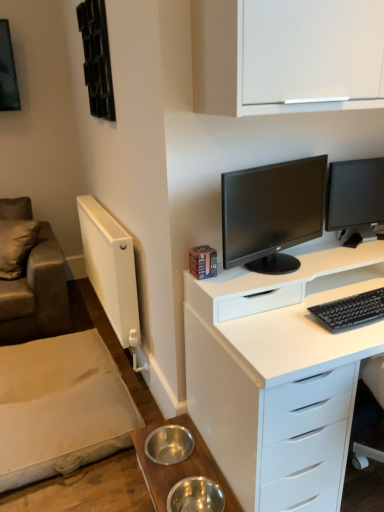
Describe the element at coordinates (286, 55) in the screenshot. I see `white matte cabinet at upper center` at that location.

This screenshot has height=512, width=384. What do you see at coordinates (355, 198) in the screenshot? I see `black glossy monitor at right, arranged as the first computer monitor when viewed from the right` at bounding box center [355, 198].

How much space does black glossy monitor at right, the second computer monitor when ordered from left to right, occupy vertically?

black glossy monitor at right, the second computer monitor when ordered from left to right, is 38.30 centimeters in height.

What do you see at coordinates (60, 407) in the screenshot? I see `beige fabric at lower left` at bounding box center [60, 407].

What do you see at coordinates (36, 294) in the screenshot?
I see `leather-like brown couch at left` at bounding box center [36, 294].

Identify the location of white matte cabinet at upper center. (286, 55).

From the image's perspective, is metallic stainless steel bowls at lower center above or below beige fabric at lower left?

From the image's perspective, metallic stainless steel bowls at lower center appears below beige fabric at lower left.

What's the angular difference between metallic stainless steel bowls at lower center and beige fabric at lower left's facing directions?

0.479 degrees separate the facing orientations of metallic stainless steel bowls at lower center and beige fabric at lower left.

Based on their positions, is metallic stainless steel bowls at lower center located to the left or right of beige fabric at lower left?

Based on their positions, metallic stainless steel bowls at lower center is located to the right of beige fabric at lower left.

Could you tell me if black matte keyboard at right is facing metallic stainless steel bowls at lower center?

No.

From a real-world perspective, relative to metallic stainless steel bowls at lower center, is black matte keyboard at right vertically above or below?

black matte keyboard at right is situated higher than metallic stainless steel bowls at lower center in the real world.

How different are the orientations of black matte keyboard at right and metallic stainless steel bowls at lower center in degrees?

They differ by 90.5 degrees in their facing directions.

Considering the relative sizes of black matte keyboard at right and metallic stainless steel bowls at lower center in the image provided, is black matte keyboard at right thinner than metallic stainless steel bowls at lower center?

Indeed, black matte keyboard at right has a lesser width compared to metallic stainless steel bowls at lower center.

Is point (207, 113) closer to camera compared to point (155, 509)?

Yes, it is in front of point (155, 509).

Is white matte cabinet at upper center outside of metallic stainless steel bowls at lower center?

Indeed, white matte cabinet at upper center is completely outside metallic stainless steel bowls at lower center.

Based on their sizes in the image, would you say white matte cabinet at upper center is bigger or smaller than metallic stainless steel bowls at lower center?

Clearly, white matte cabinet at upper center is larger in size than metallic stainless steel bowls at lower center.

From a real-world perspective, is white matte cabinet at upper center above or below metallic stainless steel bowls at lower center?

From a real-world perspective, white matte cabinet at upper center is physically above metallic stainless steel bowls at lower center.

Based on their sizes in the image, would you say black glossy monitor at right, arranged as the first computer monitor when viewed from the right, is bigger or smaller than leather-like brown couch at left?

black glossy monitor at right, arranged as the first computer monitor when viewed from the right, is smaller than leather-like brown couch at left.

Is black glossy monitor at right, arranged as the first computer monitor when viewed from the right, thinner than leather-like brown couch at left?

Indeed, black glossy monitor at right, arranged as the first computer monitor when viewed from the right, has a lesser width compared to leather-like brown couch at left.

Is black glossy monitor at right, the second computer monitor when ordered from left to right, in front of or behind leather-like brown couch at left in the image?

Visually, black glossy monitor at right, the second computer monitor when ordered from left to right, is located in front of leather-like brown couch at left.

Is black glossy monitor at right, arranged as the first computer monitor when viewed from the right, spatially inside leather-like brown couch at left, or outside of it?

black glossy monitor at right, arranged as the first computer monitor when viewed from the right, cannot be found inside leather-like brown couch at left.

Is matte black monitor at center, which is the second computer monitor from right to left, in front of or behind leather-like brown couch at left in the image?

Visually, matte black monitor at center, which is the second computer monitor from right to left, is located in front of leather-like brown couch at left.

Is matte black monitor at center, which is the second computer monitor from right to left, aimed at leather-like brown couch at left?

No, matte black monitor at center, which is the second computer monitor from right to left, is not oriented towards leather-like brown couch at left.

Consider the image. Between matte black monitor at center, the 1th computer monitor positioned from the left, and leather-like brown couch at left, which one appears on the right side from the viewer's perspective?

matte black monitor at center, the 1th computer monitor positioned from the left, is more to the right.

Considering the sizes of objects matte black monitor at center, the 1th computer monitor positioned from the left, and leather-like brown couch at left in the image provided, who is smaller, matte black monitor at center, the 1th computer monitor positioned from the left, or leather-like brown couch at left?

Smaller between the two is matte black monitor at center, the 1th computer monitor positioned from the left.

Considering the positions of objects beige fabric at lower left and matte black monitor at center, which is the second computer monitor from right to left, in the image provided, who is behind, beige fabric at lower left or matte black monitor at center, which is the second computer monitor from right to left,?

beige fabric at lower left.

Would you say beige fabric at lower left is inside or outside matte black monitor at center, which is the second computer monitor from right to left?

beige fabric at lower left cannot be found inside matte black monitor at center, which is the second computer monitor from right to left.

Considering the points (84, 349) and (262, 241), which point is behind, point (84, 349) or point (262, 241)?

Positioned behind is point (84, 349).

Considering the sizes of objects white glossy desk at center and beige fabric at lower left in the image provided, who is wider, white glossy desk at center or beige fabric at lower left?

Wider between the two is white glossy desk at center.

From the image's perspective, relative to beige fabric at lower left, is white glossy desk at center above or below?

Based on their image positions, white glossy desk at center is located above beige fabric at lower left.

Is white glossy desk at center oriented away from beige fabric at lower left?

No, white glossy desk at center's orientation is not away from beige fabric at lower left.

Considering the sizes of objects white glossy desk at center and beige fabric at lower left in the image provided, who is smaller, white glossy desk at center or beige fabric at lower left?

beige fabric at lower left.

Locate an element on the screen. The height and width of the screenshot is (512, 384). table that appears on the right of beige fabric at lower left is located at coordinates (180, 467).

The image size is (384, 512). In order to click on computer keyboard behind the metallic stainless steel bowls at lower center in this screenshot , I will do tap(351, 310).

From the image, which object appears to be farther from black matte keyboard at right, white matte cabinet at upper center or metallic stainless steel bowls at lower center?

Among the two, white matte cabinet at upper center is located further to black matte keyboard at right.

Based on their spatial positions, is white matte cabinet at upper center or black matte keyboard at right further from black glossy monitor at right, arranged as the first computer monitor when viewed from the right?

The object further to black glossy monitor at right, arranged as the first computer monitor when viewed from the right, is white matte cabinet at upper center.

From the image, which object appears to be farther from black glossy monitor at right, arranged as the first computer monitor when viewed from the right, leather-like brown couch at left or white matte cabinet at upper center?

Based on the image, leather-like brown couch at left appears to be further to black glossy monitor at right, arranged as the first computer monitor when viewed from the right.

From the image, which object appears to be farther from leather-like brown couch at left, metallic stainless steel bowls at lower center or white glossy desk at center?

white glossy desk at center is positioned further to the anchor leather-like brown couch at left.

Considering their positions, is black glossy monitor at right, the second computer monitor when ordered from left to right, positioned further to matte black monitor at center, which is the second computer monitor from right to left, than metallic stainless steel bowls at lower center?

Based on the image, metallic stainless steel bowls at lower center appears to be further to matte black monitor at center, which is the second computer monitor from right to left.

Which object lies nearer to the anchor point black matte keyboard at right, metallic stainless steel bowls at lower center or black glossy monitor at right, the second computer monitor when ordered from left to right?

black glossy monitor at right, the second computer monitor when ordered from left to right, is positioned closer to the anchor black matte keyboard at right.

Based on their spatial positions, is metallic stainless steel bowls at lower center or matte black monitor at center, which is the second computer monitor from right to left, closer to white matte cabinet at upper center?

matte black monitor at center, which is the second computer monitor from right to left, is closer to white matte cabinet at upper center.

From the image, which object appears to be nearer to leather-like brown couch at left, black matte keyboard at right or metallic stainless steel bowls at lower center?

Based on the image, metallic stainless steel bowls at lower center appears to be nearer to leather-like brown couch at left.

The image size is (384, 512). I want to click on desk between matte black monitor at center, which is the second computer monitor from right to left, and metallic stainless steel bowls at lower center from top to bottom, so click(x=279, y=374).

This screenshot has height=512, width=384. Find the location of `computer monitor between beige fabric at lower left and black glossy monitor at right, arranged as the first computer monitor when viewed from the right, from left to right`. computer monitor between beige fabric at lower left and black glossy monitor at right, arranged as the first computer monitor when viewed from the right, from left to right is located at coordinates (270, 206).

Where is `plain located between leather-like brown couch at left and matte black monitor at center, which is the second computer monitor from right to left, in the left-right direction`? The height and width of the screenshot is (512, 384). plain located between leather-like brown couch at left and matte black monitor at center, which is the second computer monitor from right to left, in the left-right direction is located at coordinates [x=60, y=407].

I want to click on table between leather-like brown couch at left and matte black monitor at center, which is the second computer monitor from right to left, in the horizontal direction, so click(x=180, y=467).